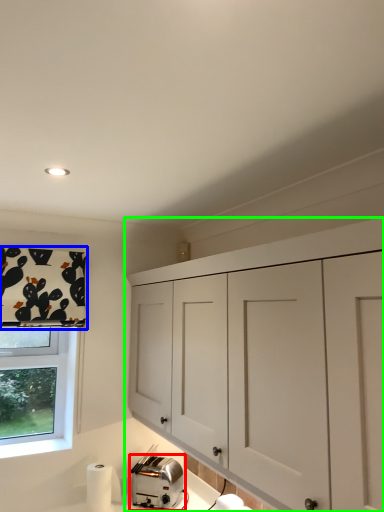
Question: Based on their relative distances, which object is nearer to toaster (highlighted by a red box)? Choose from curtain (highlighted by a blue box) and cabinetry (highlighted by a green box).

Choices:
 (A) curtain
 (B) cabinetry

Answer: (B)